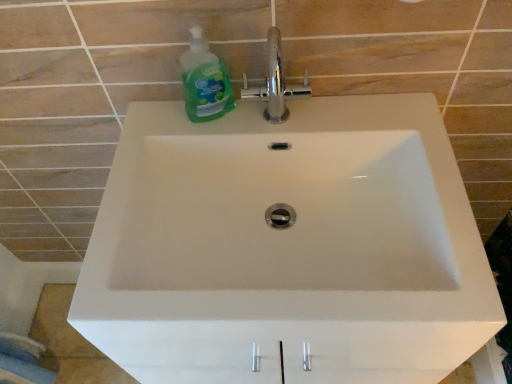
Identify the location of free spot to the right of chrome metallic faucet at upper center. The height and width of the screenshot is (384, 512). (362, 125).